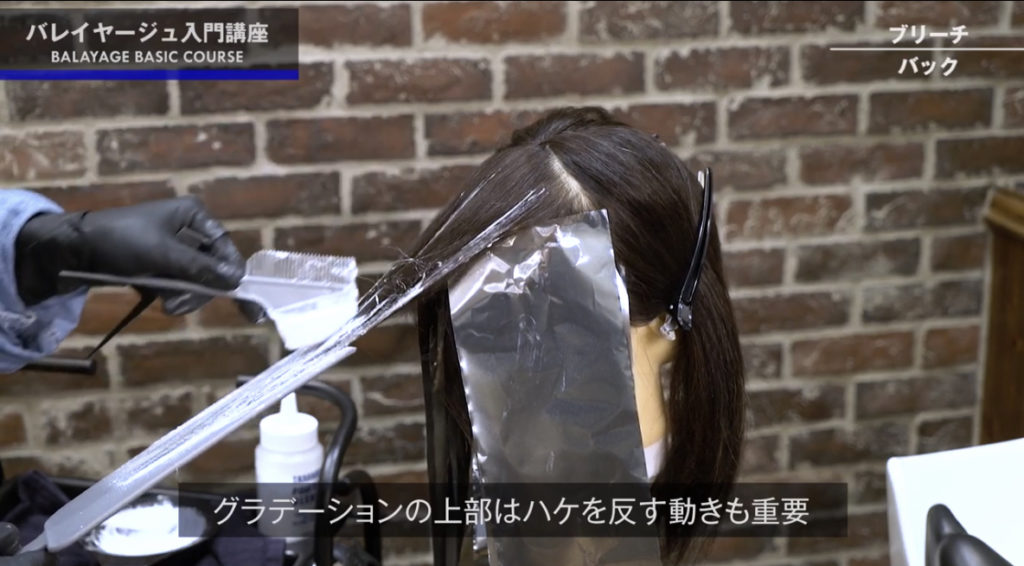
Find the location of `brick wall in the background`. brick wall in the background is located at coordinates 368,98.